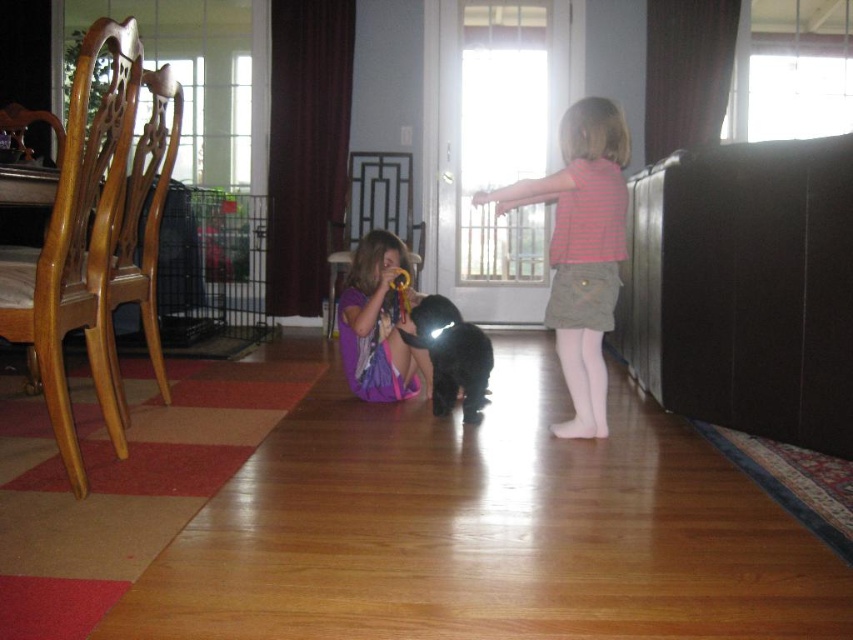
Question: Does matte purple dress at center have a smaller size compared to black fur dog at center?

Choices:
 (A) yes
 (B) no

Answer: (B)

Question: Does matte purple dress at center lie behind black fur dog at center?

Choices:
 (A) no
 (B) yes

Answer: (B)

Question: Which of the following is the closest to the observer?

Choices:
 (A) striped cotton shirt at center
 (B) matte purple dress at center

Answer: (A)

Question: Can you confirm if matte purple dress at center is smaller than black fur dog at center?

Choices:
 (A) yes
 (B) no

Answer: (B)

Question: Among these objects, which one is nearest to the camera?

Choices:
 (A) striped cotton shirt at center
 (B) black fur dog at center
 (C) matte purple dress at center

Answer: (A)

Question: Which point appears farthest from the camera in this image?

Choices:
 (A) (602, 314)
 (B) (389, 288)

Answer: (B)